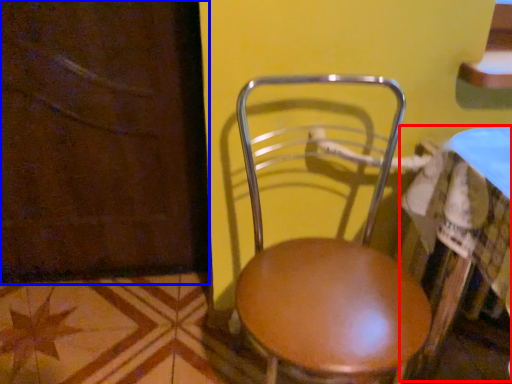
Question: Among these objects, which one is nearest to the camera, table (highlighted by a red box) or screen door (highlighted by a blue box)?

Choices:
 (A) table
 (B) screen door

Answer: (A)